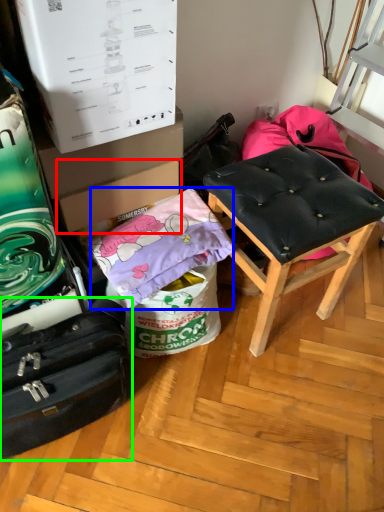
Question: Which object is the closest to the cardboard box (highlighted by a red box)? Choose among these: material (highlighted by a blue box) or suitcase (highlighted by a green box).

Choices:
 (A) material
 (B) suitcase

Answer: (A)